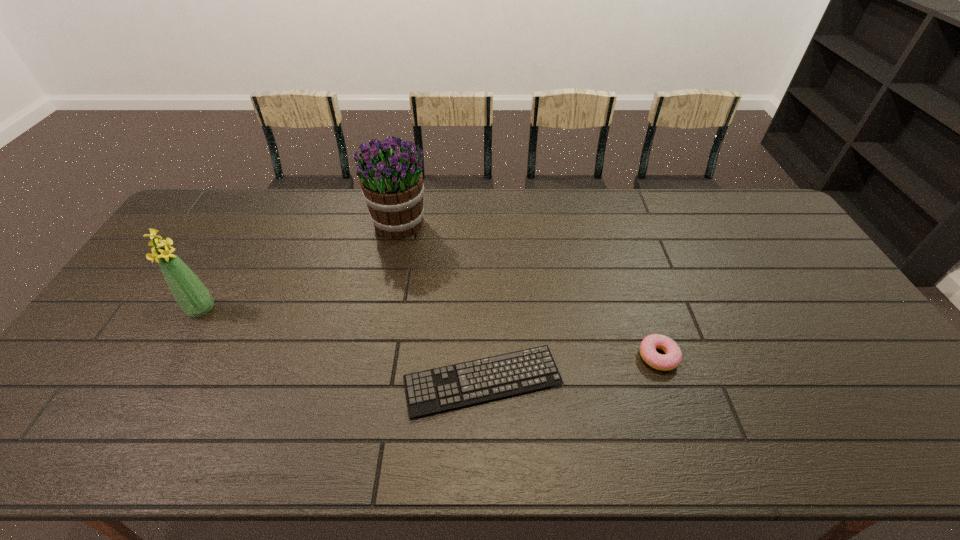
I want to click on vacant area in the image that satisfies the following two spatial constraints: 1. on the front-facing side of the leftmost object; 2. on the right side of the shortest object, so click(160, 381).

Identify the location of vacant area in the image that satisfies the following two spatial constraints: 1. on the front-facing side of the third nearest object; 2. on the right side of the shortest object. This screenshot has width=960, height=540. (160, 381).

I want to click on free point that satisfies the following two spatial constraints: 1. on the front side of the rightmost object; 2. on the right side of the right bouquet, so click(372, 356).

Find the location of a particular element. Image resolution: width=960 pixels, height=540 pixels. vacant space that satisfies the following two spatial constraints: 1. on the front side of the right bouquet; 2. on the left side of the computer keyboard is located at coordinates (367, 381).